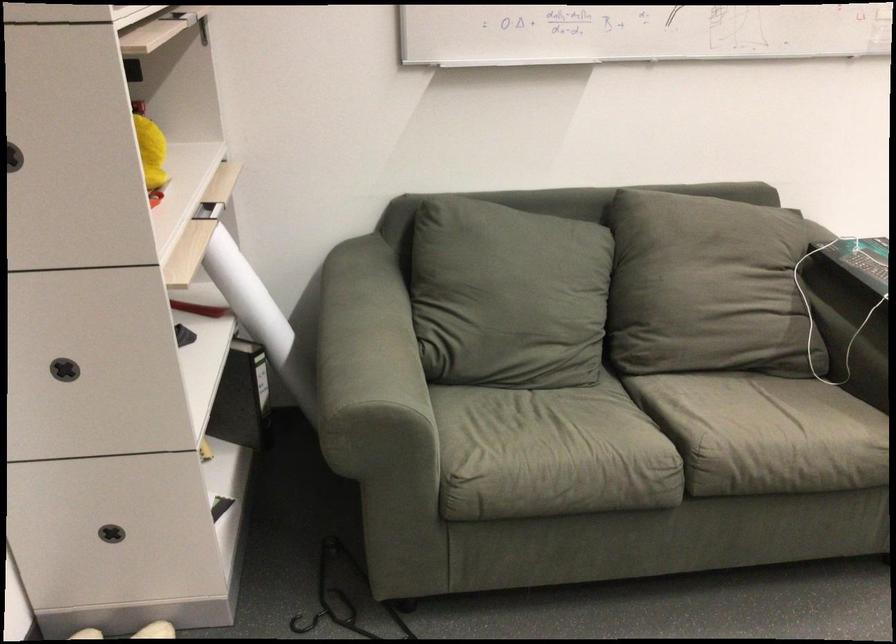
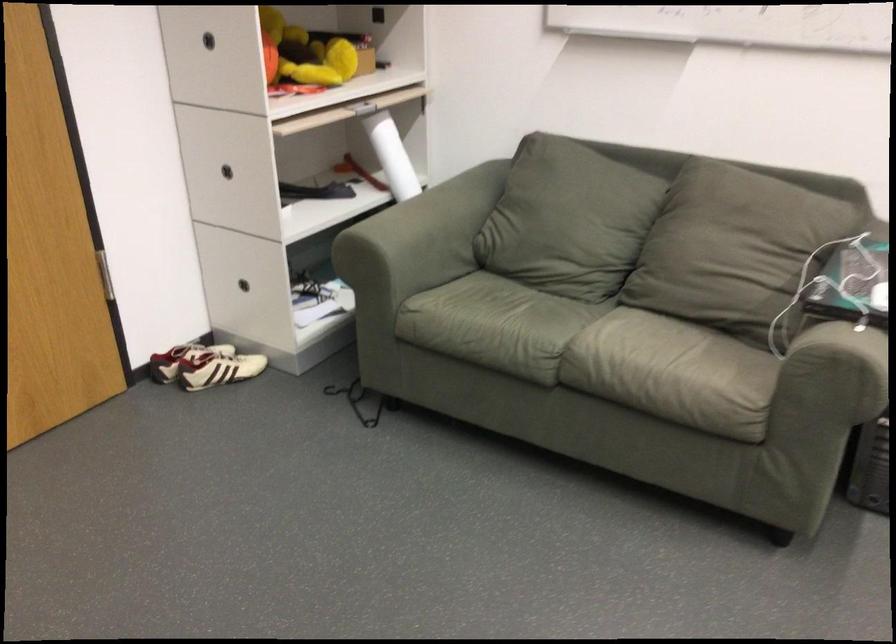
Find the pixel in the second image that matches point 412,380 in the first image.

(416, 242)